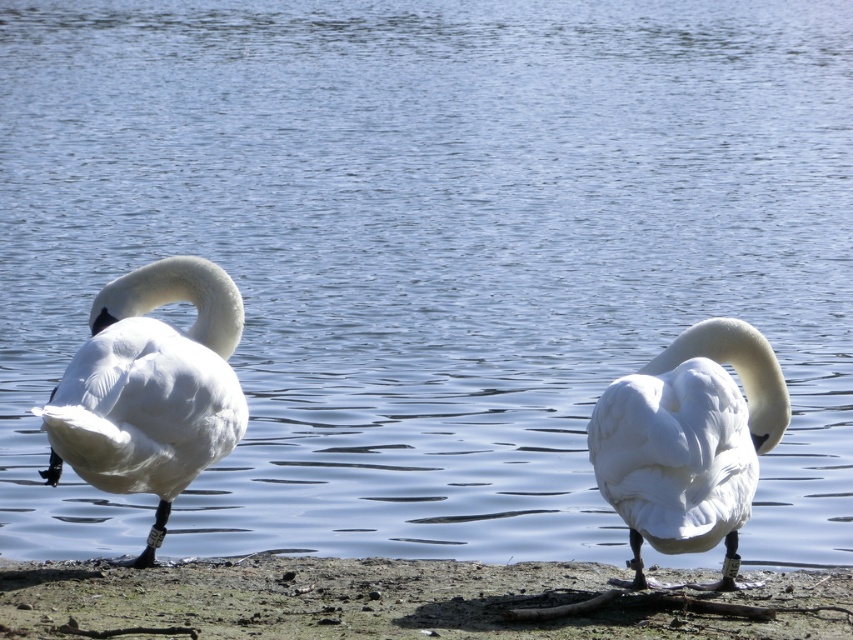
Question: Among these points, which one is nearest to the camera?

Choices:
 (A) (715, 458)
 (B) (207, 612)
 (C) (105, 289)

Answer: (B)

Question: Can you confirm if muddy sand at lower center is smaller than white glossy swan at center?

Choices:
 (A) yes
 (B) no

Answer: (B)

Question: Which object is positioned closest to the muddy sand at lower center?

Choices:
 (A) white feathered swan at left
 (B) white glossy swan at center

Answer: (B)

Question: Is white feathered swan at left positioned in front of white glossy swan at center?

Choices:
 (A) no
 (B) yes

Answer: (B)

Question: Can you confirm if muddy sand at lower center is smaller than white glossy swan at center?

Choices:
 (A) no
 (B) yes

Answer: (A)

Question: Which object is farther from the camera taking this photo?

Choices:
 (A) white glossy swan at center
 (B) muddy sand at lower center

Answer: (A)